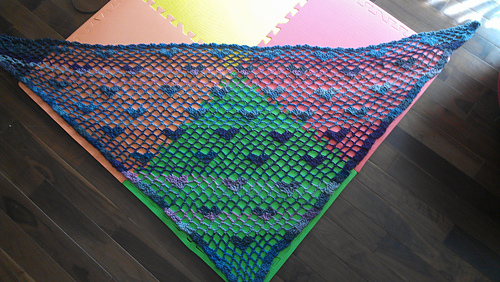
I want to click on green tile, so click(283, 256).